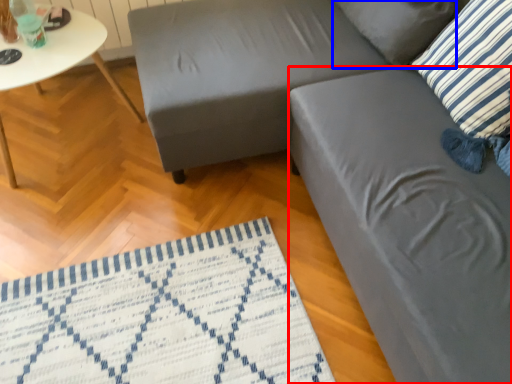
Question: Which point is further to the camera, swivel chair (highlighted by a red box) or pillow (highlighted by a blue box)?

Choices:
 (A) swivel chair
 (B) pillow

Answer: (B)